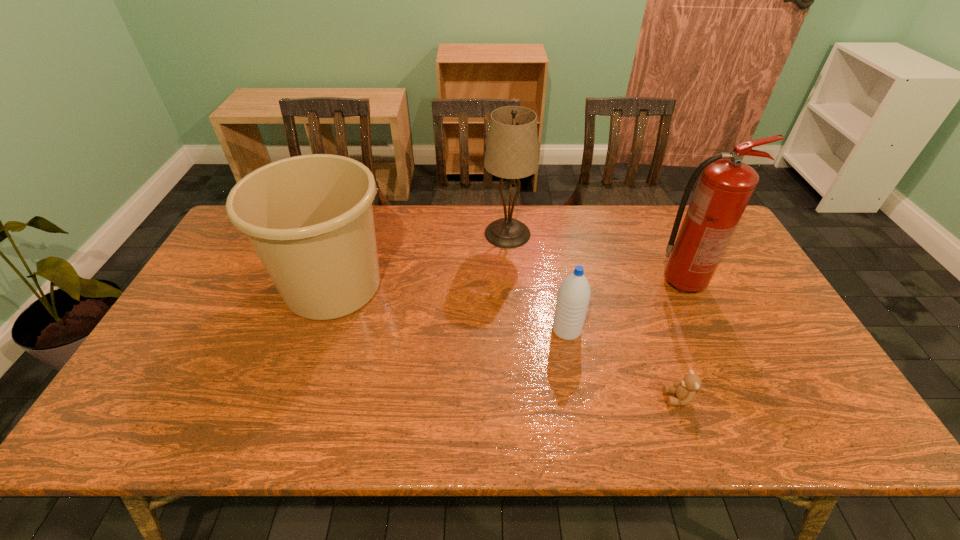
This screenshot has height=540, width=960. Find the location of `empty space between the lampshade and the third tallest object`. empty space between the lampshade and the third tallest object is located at coordinates (420, 260).

The height and width of the screenshot is (540, 960). I want to click on empty space that is in between the fire extinguisher and the leftmost object, so click(x=507, y=284).

Identify the location of free point between the second object from left to right and the fire extinguisher. The image size is (960, 540). (595, 258).

Image resolution: width=960 pixels, height=540 pixels. Find the location of `free spot between the second object from left to right and the third object from left to right`. free spot between the second object from left to right and the third object from left to right is located at coordinates (538, 282).

I want to click on empty space that is in between the water bottle and the lampshade, so click(x=538, y=282).

Where is `empty space that is in between the rightmost object and the fourth tallest object`? Image resolution: width=960 pixels, height=540 pixels. empty space that is in between the rightmost object and the fourth tallest object is located at coordinates (624, 306).

Where is `object that is the second closest to the rightmost object`? object that is the second closest to the rightmost object is located at coordinates (685, 390).

In order to click on object that is the second closest one to the fire extinguisher in this screenshot , I will do `click(685, 390)`.

Locate an element on the screen. vacant space that satisfies the following two spatial constraints: 1. on the front-facing side of the second object from left to right; 2. on the front side of the third shortest object is located at coordinates (512, 286).

Identify the location of free spot that satisfies the following two spatial constraints: 1. on the back side of the third object from right to left; 2. on the front-facing side of the second object from left to right. This screenshot has width=960, height=540. (549, 234).